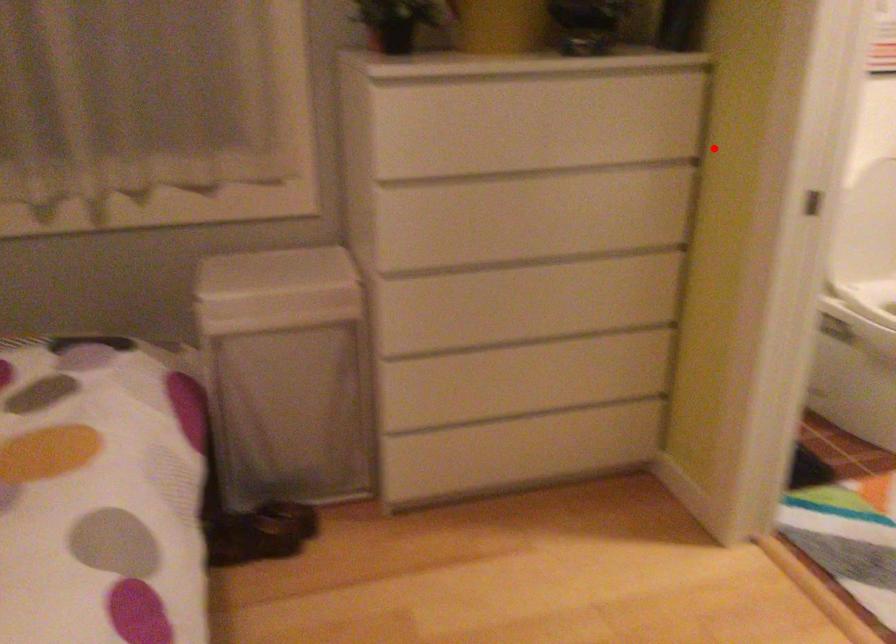
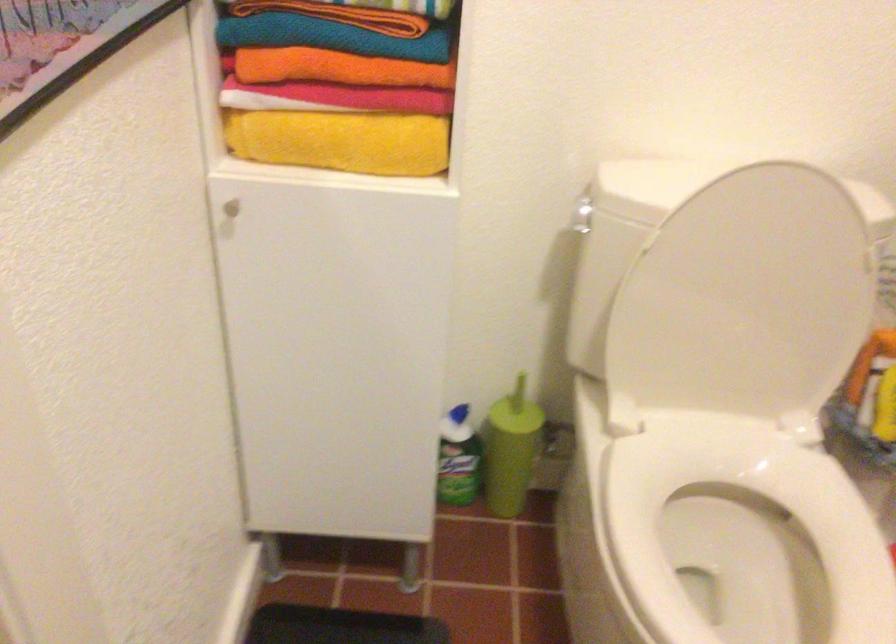
Question: I am providing you with two images of the same scene from different viewpoints. Given a red point in image1, look at the same physical point in image2. Is it:

Choices:
 (A) Closer to the viewpoint
 (B) Farther from the viewpoint

Answer: (A)